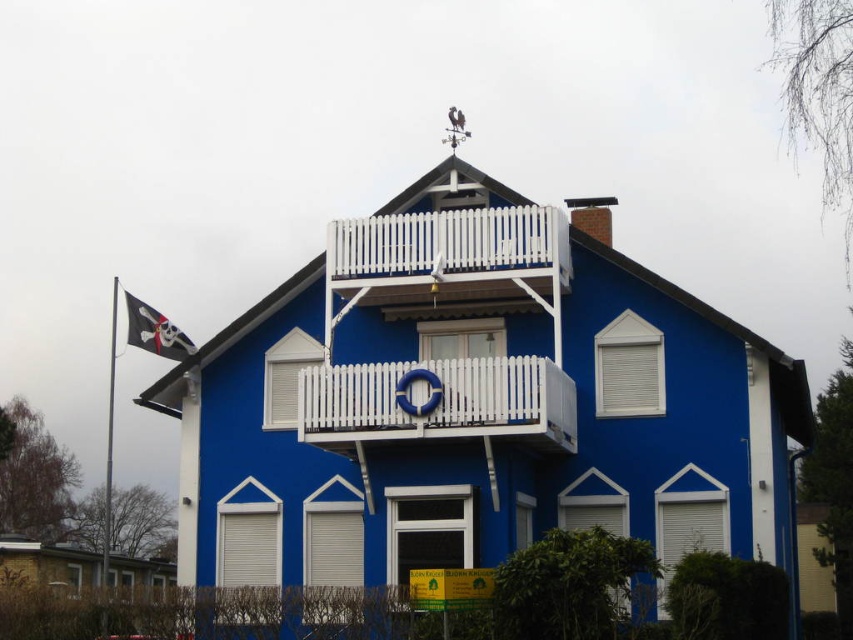
Between point (497, 369) and point (169, 353), which one is positioned in front?

Point (497, 369)

Is white wooden balustrade at center below black fabric pirate flag at left?

Yes, white wooden balustrade at center is below black fabric pirate flag at left.

Does point (550, 401) lie in front of point (157, 344)?

Yes, point (550, 401) is closer to viewer.

Where is `white wooden balustrade at center`? white wooden balustrade at center is located at coordinates (437, 401).